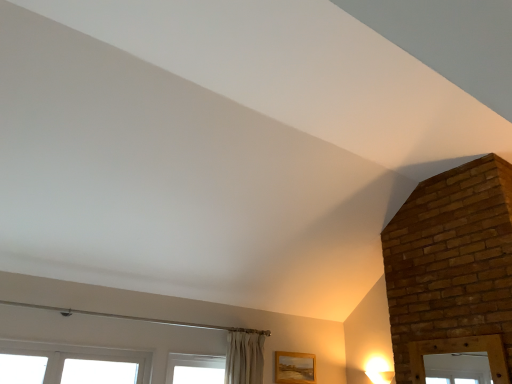
Measure the distance between point (100,349) and camera.

They are 10.98 feet apart.

What do you see at coordinates (294, 368) in the screenshot?
I see `wooden frame at lower right` at bounding box center [294, 368].

In order to click on matte white light fixture at lower right in this screenshot , I will do `click(379, 371)`.

Locate an element on the screen. light fixture below the white plastic window at lower left (from the image's perspective) is located at coordinates (379, 371).

Considering the relative sizes of white plastic window at lower left and matte white light fixture at lower right in the image provided, is white plastic window at lower left thinner than matte white light fixture at lower right?

Indeed, white plastic window at lower left has a lesser width compared to matte white light fixture at lower right.

What's the angular difference between white plastic window at lower left and matte white light fixture at lower right's facing directions?

The angular difference between white plastic window at lower left and matte white light fixture at lower right is 89.5 degrees.

Which point is more distant from viewer, (46, 352) or (388, 373)?

Positioned behind is point (388, 373).

Is wooden frame at lower right not within white plastic window at lower left?

wooden frame at lower right is positioned outside white plastic window at lower left.

Is wooden frame at lower right bigger than white plastic window at lower left?

No, wooden frame at lower right is not bigger than white plastic window at lower left.

From a real-world perspective, which object stands above the other?

wooden frame at lower right, from a real-world perspective.

Find the location of a particular element. Image resolution: width=512 pixels, height=384 pixels. light fixture below the white plastic window at lower left (from the image's perspective) is located at coordinates (379, 371).

Is matte white light fixture at lower right facing away from white plastic window at lower left?

No.

Which is farther from the camera, [374,376] or [8,347]?

Point [374,376]

Is matte white light fixture at lower right to the left of wooden frame at lower right from the viewer's perspective?

Incorrect, matte white light fixture at lower right is not on the left side of wooden frame at lower right.

Considering the points (372, 378) and (304, 356), which point is in front, point (372, 378) or point (304, 356)?

Point (372, 378)

Considering their positions, is matte white light fixture at lower right located in front of or behind wooden frame at lower right?

matte white light fixture at lower right is positioned closer to the viewer than wooden frame at lower right.

You are a GUI agent. You are given a task and a screenshot of the screen. Output one action in this format:
    pyautogui.click(x=<x>, y=<y>)
    Task: Click on the light fixture located underneath the wooden frame at lower right (from a real-world perspective)
    
    Given the screenshot: What is the action you would take?
    pyautogui.click(x=379, y=371)

Where is `picture frame below the white plastic window at lower left (from the image's perspective)`? The image size is (512, 384). picture frame below the white plastic window at lower left (from the image's perspective) is located at coordinates (294, 368).

Is point (125, 358) less distant than point (284, 361)?

Yes, it is in front of point (284, 361).

From a real-world perspective, relative to wooden frame at lower right, is white plastic window at lower left vertically above or below?

From a real-world perspective, white plastic window at lower left is physically below wooden frame at lower right.

Who is bigger, white plastic window at lower left or wooden frame at lower right?

Bigger between the two is white plastic window at lower left.

Is wooden frame at lower right bigger than matte white light fixture at lower right?

No.

Is wooden frame at lower right not near matte white light fixture at lower right?

wooden frame at lower right is near matte white light fixture at lower right, not far away.

How many degrees apart are the facing directions of wooden frame at lower right and matte white light fixture at lower right?

The angular difference between wooden frame at lower right and matte white light fixture at lower right is 90 degrees.

Which is less distant, (286, 365) or (385, 378)?

Point (286, 365) is positioned farther from the camera compared to point (385, 378).

Find the location of `light fixture behind the white plastic window at lower left`. light fixture behind the white plastic window at lower left is located at coordinates (379, 371).

At what (x,y) coordinates should I click in order to perform the action: click on picture frame lying below the white plastic window at lower left (from the image's perspective). Please return your answer as a coordinate pair (x, y). Looking at the image, I should click on (294, 368).

Considering their positions, is white plastic window at lower left positioned closer to wooden frame at lower right than matte white light fixture at lower right?

matte white light fixture at lower right is closer to wooden frame at lower right.

In the scene shown: Based on their spatial positions, is wooden frame at lower right or matte white light fixture at lower right further from white plastic window at lower left?

Based on the image, matte white light fixture at lower right appears to be further to white plastic window at lower left.

Based on their spatial positions, is matte white light fixture at lower right or wooden frame at lower right further from white plastic window at lower left?

matte white light fixture at lower right is positioned further to the anchor white plastic window at lower left.

Estimate the real-world distances between objects in this image. Which object is closer to wooden frame at lower right, matte white light fixture at lower right or white plastic window at lower left?

matte white light fixture at lower right is positioned closer to the anchor wooden frame at lower right.

Based on their spatial positions, is wooden frame at lower right or white plastic window at lower left closer to matte white light fixture at lower right?

Among the two, wooden frame at lower right is located nearer to matte white light fixture at lower right.

Considering their positions, is white plastic window at lower left positioned further to matte white light fixture at lower right than wooden frame at lower right?

Among the two, white plastic window at lower left is located further to matte white light fixture at lower right.

Identify the location of picture frame located between white plastic window at lower left and matte white light fixture at lower right in the left-right direction. The width and height of the screenshot is (512, 384). (294, 368).